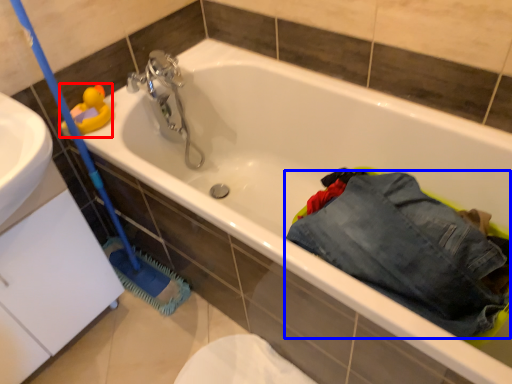
Question: Among these objects, which one is farthest to the camera, toy (highlighted by a red box) or trousers (highlighted by a blue box)?

Choices:
 (A) toy
 (B) trousers

Answer: (A)